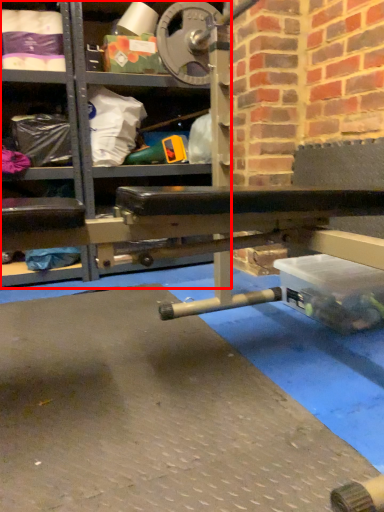
Question: From the image's perspective, where is shelf (annotated by the red box) located in relation to shelf in the image?

Choices:
 (A) above
 (B) below

Answer: (A)